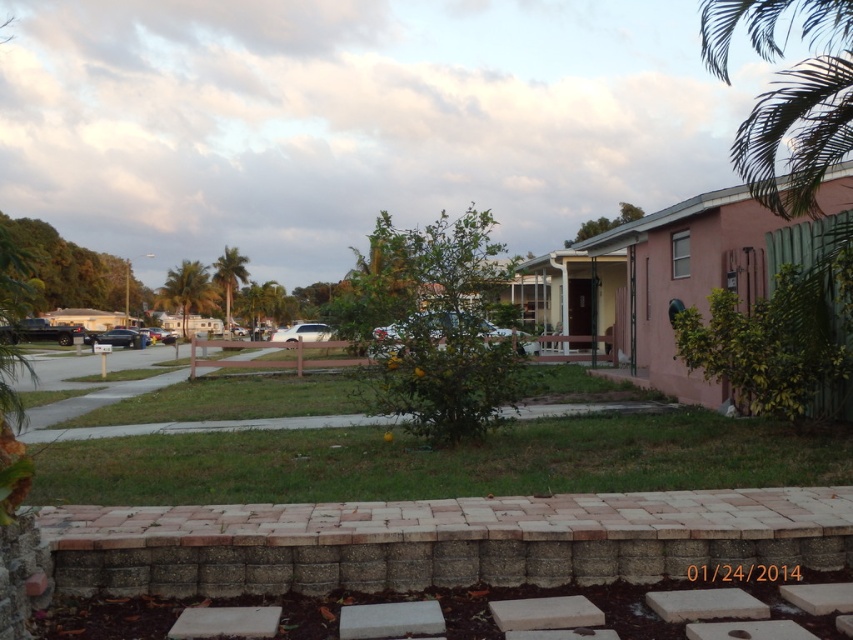
Question: Does green leafy palm tree at center appear on the left side of green leafy palm tree at left?

Choices:
 (A) yes
 (B) no

Answer: (B)

Question: Can you confirm if green grass at center is wider than green leafy palm tree at upper left?

Choices:
 (A) yes
 (B) no

Answer: (A)

Question: Which object is the closest to the green leafy palm tree at center?

Choices:
 (A) green leafy palm tree at left
 (B) green leafy palm tree at upper left

Answer: (A)

Question: Which of the following is the closest to the observer?

Choices:
 (A) (801, 460)
 (B) (178, 269)
 (C) (277, 300)
 (D) (225, 253)

Answer: (A)

Question: Is green grass at center closer to the viewer compared to green leafy palm tree at left?

Choices:
 (A) no
 (B) yes

Answer: (B)

Question: Among these points, which one is farthest from the camera?

Choices:
 (A) (219, 259)
 (B) (189, 275)
 (C) (285, 454)

Answer: (B)